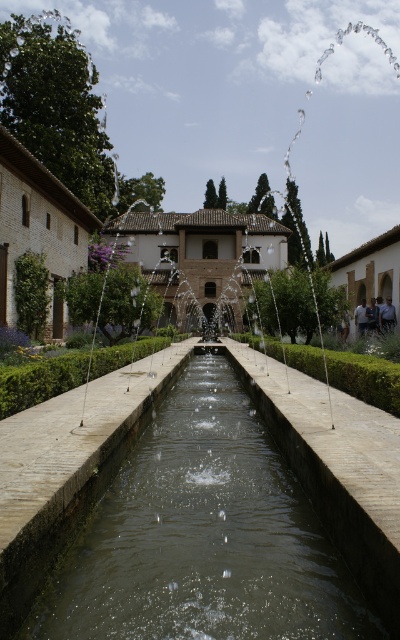
Does point (162, 616) lie behind point (348, 371)?

No, it is not.

Who is lower down, clear water at center or green stone fountain at center?

clear water at center is below.

Does point (275, 500) come closer to viewer compared to point (45, 387)?

Yes, point (275, 500) is in front of point (45, 387).

What are the coordinates of `clear water at center` in the screenshot? It's located at (198, 538).